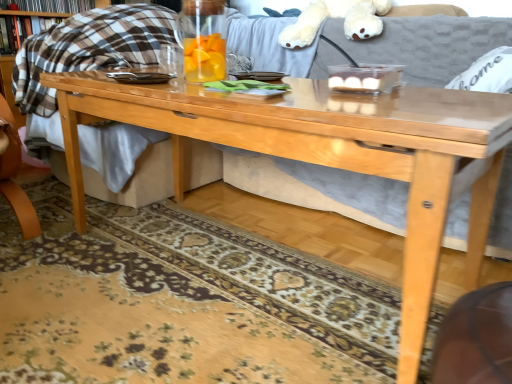
Question: In the image, is transparent glass pitcher at center on the left side or the right side of white plush bear at upper center?

Choices:
 (A) right
 (B) left

Answer: (B)

Question: Considering their positions, is transparent glass pitcher at center located in front of or behind white plush bear at upper center?

Choices:
 (A) front
 (B) behind

Answer: (A)

Question: Which object is positioned closest to the transparent glass pitcher at center?

Choices:
 (A) plaid fabric book at upper left, the second book from the top
 (B) white fabric pillow at upper right
 (C) hardcover book at upper left, marked as the first book in a top-to-bottom arrangement
 (D) white plush bear at upper center

Answer: (B)

Question: Which of these objects is positioned farthest from the hardcover book at upper left, marked as the first book in a top-to-bottom arrangement?

Choices:
 (A) plaid fabric book at upper left, marked as the 1th book in a bottom-to-top arrangement
 (B) transparent glass pitcher at center
 (C) white fabric pillow at upper right
 (D) white plush bear at upper center

Answer: (C)